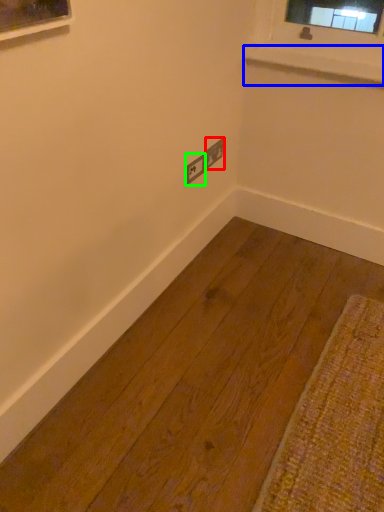
Question: Which object is positioned closest to electric outlet (highlighted by a red box)? Select from window sill (highlighted by a blue box) and electric outlet (highlighted by a green box).

Choices:
 (A) window sill
 (B) electric outlet

Answer: (B)